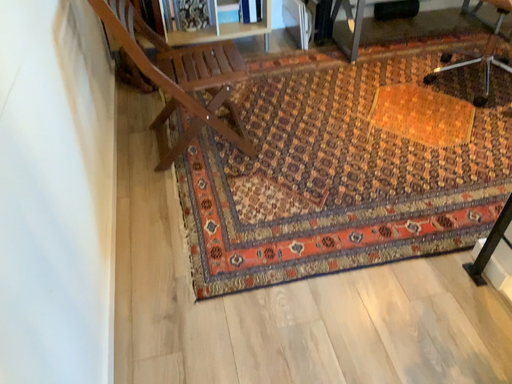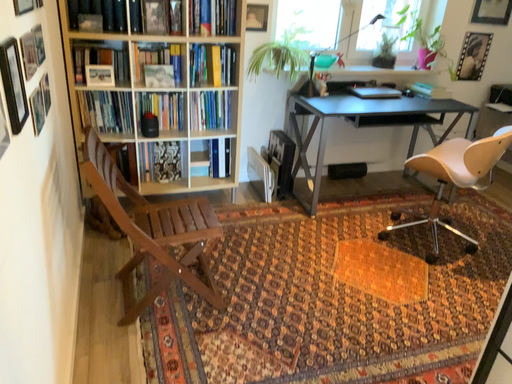
Question: How did the camera likely rotate when shooting the video?

Choices:
 (A) rotated right
 (B) rotated left

Answer: (A)